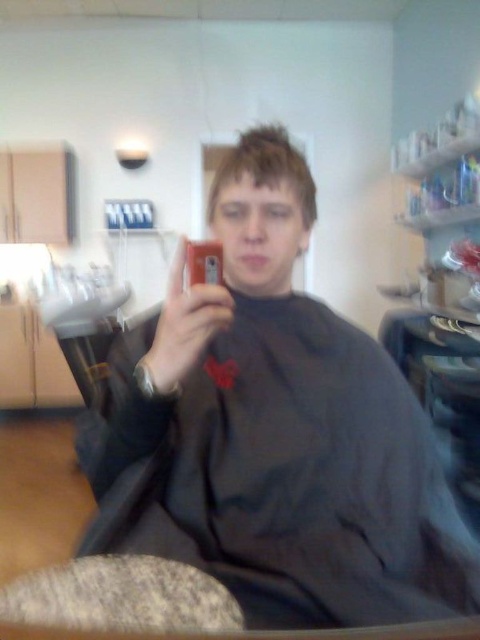
Question: Does spiky brown hair at center have a smaller size compared to matte black phone at center?

Choices:
 (A) yes
 (B) no

Answer: (B)

Question: Which of the following is the farthest from the observer?

Choices:
 (A) spiky brown hair at center
 (B) matte black phone at center

Answer: (A)

Question: Is spiky brown hair at center positioned in front of matte black phone at center?

Choices:
 (A) no
 (B) yes

Answer: (A)

Question: Is spiky brown hair at center closer to the viewer compared to matte black phone at center?

Choices:
 (A) no
 (B) yes

Answer: (A)